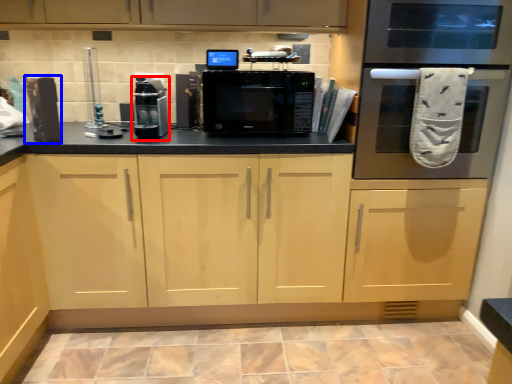
Question: Which of the following is the closest to the observer, appliance (highlighted by a red box) or appliance (highlighted by a blue box)?

Choices:
 (A) appliance
 (B) appliance

Answer: (B)